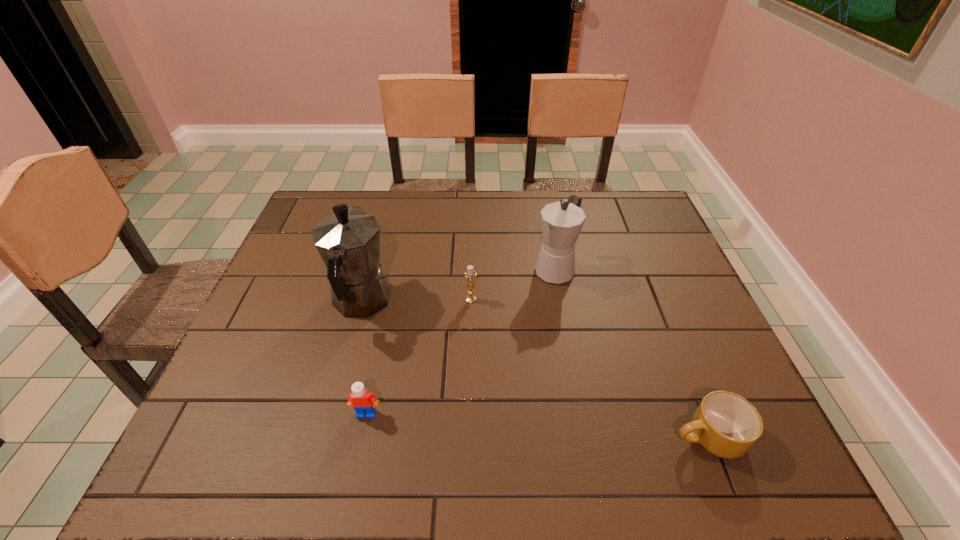
The width and height of the screenshot is (960, 540). I want to click on blank area in the image that satisfies the following two spatial constraints: 1. on the side with the handle of the shortest object; 2. on the front side of the shorter coffeepot, so click(x=640, y=269).

I want to click on vacant position in the image that satisfies the following two spatial constraints: 1. on the pouring side of the fourth object from left to right; 2. on the left side of the left coffeepot, so click(370, 269).

This screenshot has width=960, height=540. What are the coordinates of `free spot that satisfies the following two spatial constraints: 1. on the side with the handle of the shortest object; 2. on the front side of the fourth object from left to right` in the screenshot? It's located at (640, 269).

The width and height of the screenshot is (960, 540). I want to click on blank space that satisfies the following two spatial constraints: 1. on the back side of the shorter coffeepot; 2. on the right side of the candle holder, so tap(471, 269).

The height and width of the screenshot is (540, 960). Find the location of `vacant space that satisfies the following two spatial constraints: 1. on the side with the handle of the mug; 2. on the front side of the candle holder`. vacant space that satisfies the following two spatial constraints: 1. on the side with the handle of the mug; 2. on the front side of the candle holder is located at coordinates (652, 299).